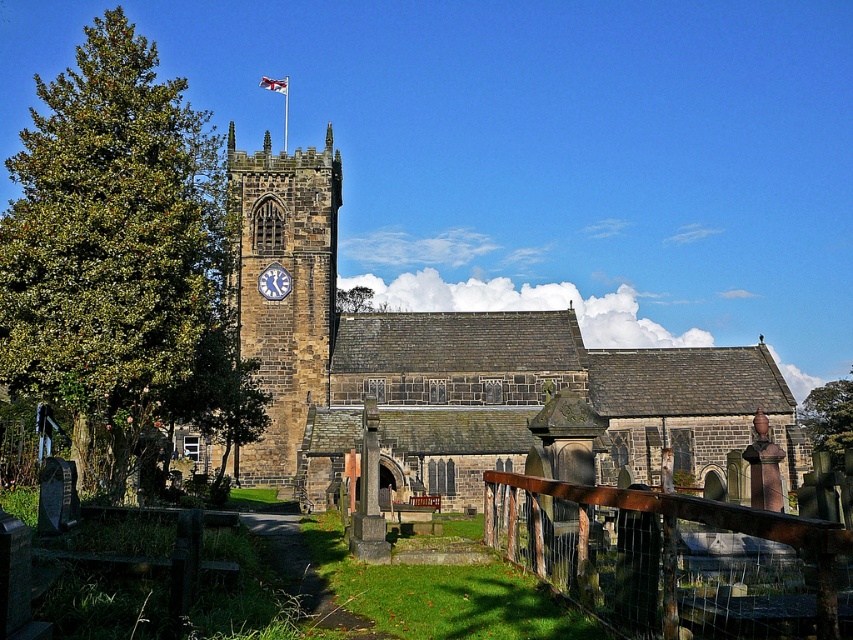
Can you confirm if matte stone clock at center-left is taller than blue fabric flag at upper center?

No, matte stone clock at center-left is not taller than blue fabric flag at upper center.

Between matte stone clock at center-left and blue fabric flag at upper center, which one appears on the left side from the viewer's perspective?

blue fabric flag at upper center is more to the left.

Does point (262, 288) lie in front of point (271, 84)?

Yes, it is in front of point (271, 84).

This screenshot has height=640, width=853. In order to click on matte stone clock at center-left in this screenshot , I will do `click(274, 282)`.

Between green leafy tree at left and matte stone clock at center-left, which one is positioned higher?

Positioned higher is green leafy tree at left.

Does green leafy tree at left have a greater width compared to matte stone clock at center-left?

Yes, green leafy tree at left is wider than matte stone clock at center-left.

Is point (15, 372) positioned before point (265, 276)?

Yes, point (15, 372) is closer to viewer.

You are a GUI agent. You are given a task and a screenshot of the screen. Output one action in this format:
    pyautogui.click(x=<x>, y=<y>)
    Task: Click on the green leafy tree at left
    
    Given the screenshot: What is the action you would take?
    pyautogui.click(x=117, y=248)

Which is behind, point (846, 556) or point (270, 83)?

Positioned behind is point (270, 83).

Which is in front, point (724, 524) or point (283, 90)?

Point (724, 524)

Where is `rusty metal fence at lower center`? rusty metal fence at lower center is located at coordinates [674, 557].